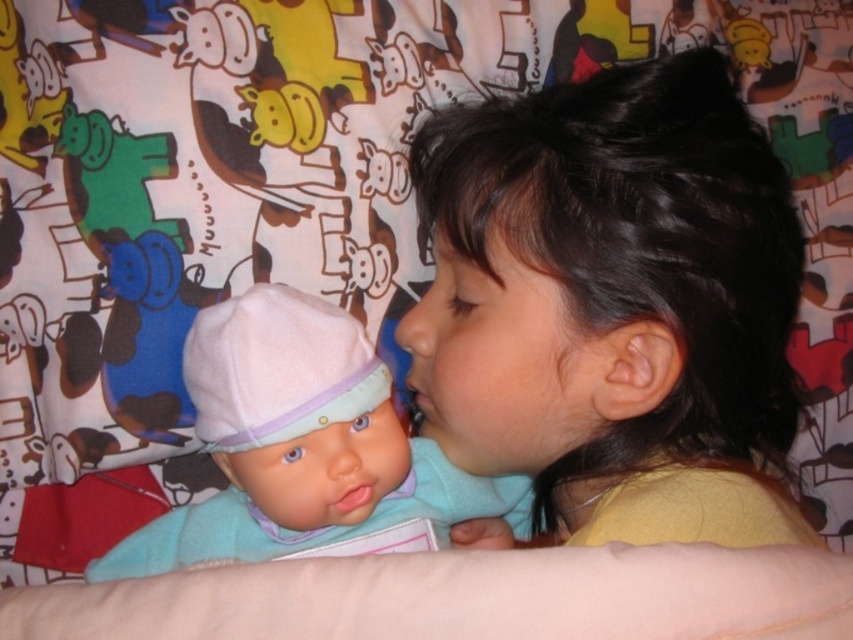
You are a photographer trying to capture a closeup shot of the smooth brown hair at upper right and the matte pink fabric doll at left. Which object should you focus on first if you want to ensure both are in focus?

The smooth brown hair at upper right is closer to the viewer than the matte pink fabric doll at left. To ensure both are in focus, focus on the matte pink fabric doll at left first since it is further away, allowing the depth of field to cover the closer object as well.